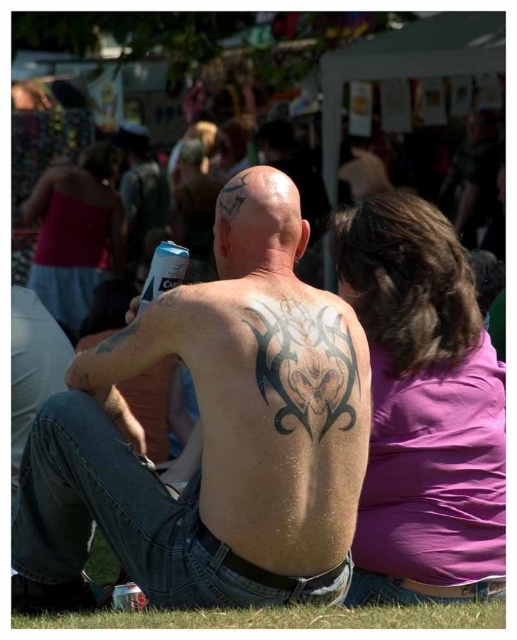
Question: Which object is positioned closest to the dark skin tattoo at center?

Choices:
 (A) green grass at lower center
 (B) purple matte shirt at upper right
 (C) matte pink tank top at upper left

Answer: (A)

Question: Considering the relative positions of dark skin tattoo at center and black tattoo at upper back in the image provided, where is dark skin tattoo at center located with respect to black tattoo at upper back?

Choices:
 (A) above
 (B) below

Answer: (B)

Question: Observing the image, what is the correct spatial positioning of dark skin tattoo at center in reference to green grass at lower center?

Choices:
 (A) right
 (B) left

Answer: (B)

Question: Does purple matte shirt at upper right appear under black tattoo at upper back?

Choices:
 (A) no
 (B) yes

Answer: (B)

Question: Estimate the real-world distances between objects in this image. Which object is farther from the green grass at lower center?

Choices:
 (A) purple matte shirt at upper right
 (B) black tattoo at upper back

Answer: (B)

Question: Which point is closer to the camera?

Choices:
 (A) (234, 346)
 (B) (53, 230)
 (C) (347, 376)
 (D) (358, 611)

Answer: (A)